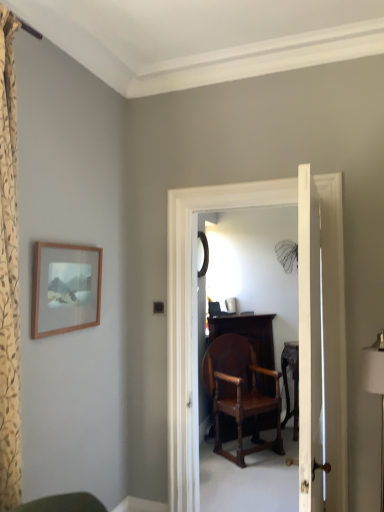
Question: In terms of width, does black glass mirror at center look wider or thinner when compared to mahogany wood chair at center?

Choices:
 (A) thin
 (B) wide

Answer: (A)

Question: From a real-world perspective, is black glass mirror at center above or below mahogany wood chair at center?

Choices:
 (A) below
 (B) above

Answer: (B)

Question: Based on their relative distances, which object is farther from the white wooden door at center?

Choices:
 (A) mahogany wood chair at center
 (B) black glass mirror at center
 (C) white fabric lampshade at right
 (D) wooden carved table at center
 (E) wooden picture frame at upper left

Answer: (B)

Question: Considering the real-world distances, which object is farthest from the black glass mirror at center?

Choices:
 (A) mahogany wood chair at center
 (B) wooden picture frame at upper left
 (C) white fabric lampshade at right
 (D) white wooden door at center
 (E) wooden carved table at center

Answer: (D)